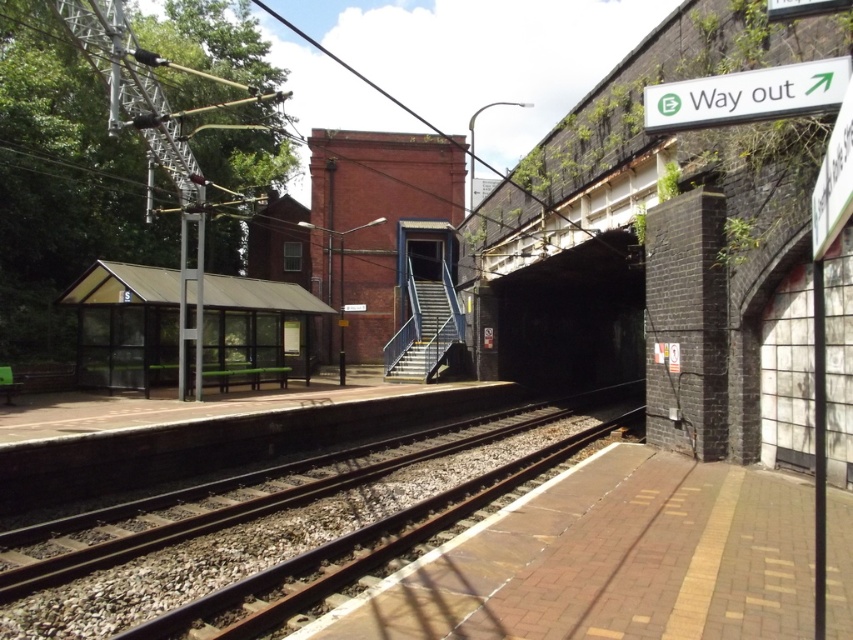
You are a maintenance worker standing at the camera position. You need to inspect the brown metal train track at center. Can you reach it without moving from your current position?

The brown metal train track at center and camera are 5.73 meters apart. Since the distance is within a reasonable range for inspection without moving, you can reach it without moving from your current position.

You are standing on the platform at the railway station and want to reach a specific point marked at coordinates point [341,522]. If your walking speed is 1.2 meters per second, approximately how many seconds will it take you to reach that point?

The distance of point [341,522] from camera is 9.39 meters. At a walking speed of 1.2 meters per second, it will take approximately 7.83 seconds to reach the point. Since we usually round to the nearest whole number, it would take about 8 seconds.

You are a visually impaired person using a cane to navigate the platform. You feel the tactile paving strip and want to reach the transparent plastic bus stop at left. Which direction should you move relative to the brown metal train track at center?

You should move to the left of the brown metal train track at center to reach the transparent plastic bus stop at left since the brown metal train track at center is to the right of transparent plastic bus stop at left.